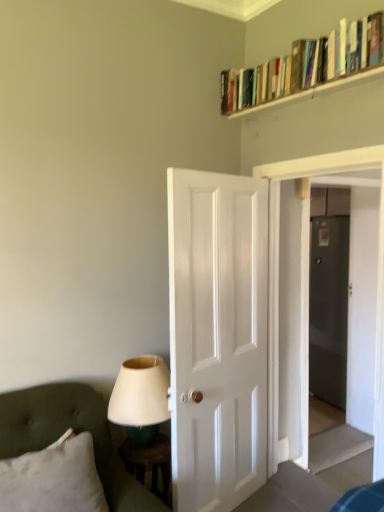
Question: Can you confirm if wooden stool at lower left is shorter than matte white lampshade at lower left?

Choices:
 (A) yes
 (B) no

Answer: (B)

Question: Can you confirm if wooden stool at lower left is thinner than matte white lampshade at lower left?

Choices:
 (A) yes
 (B) no

Answer: (A)

Question: Considering the relative sizes of wooden stool at lower left and matte white lampshade at lower left in the image provided, is wooden stool at lower left smaller than matte white lampshade at lower left?

Choices:
 (A) yes
 (B) no

Answer: (A)

Question: Does wooden stool at lower left have a greater width compared to matte white lampshade at lower left?

Choices:
 (A) no
 (B) yes

Answer: (A)

Question: Does wooden stool at lower left come in front of matte white lampshade at lower left?

Choices:
 (A) yes
 (B) no

Answer: (B)

Question: Considering the relative positions of white soft pillow at lower left and wooden stool at lower left in the image provided, is white soft pillow at lower left to the left or to the right of wooden stool at lower left?

Choices:
 (A) left
 (B) right

Answer: (A)

Question: Based on their sizes in the image, would you say white soft pillow at lower left is bigger or smaller than wooden stool at lower left?

Choices:
 (A) small
 (B) big

Answer: (B)

Question: From the image's perspective, is white soft pillow at lower left positioned above or below wooden stool at lower left?

Choices:
 (A) below
 (B) above

Answer: (B)

Question: Would you say white soft pillow at lower left is inside or outside wooden stool at lower left?

Choices:
 (A) inside
 (B) outside

Answer: (B)

Question: Would you say transparent glass door at center, which ranks as the 1th glass door in front-to-back order, is to the left or to the right of matte white lampshade at lower left in the picture?

Choices:
 (A) left
 (B) right

Answer: (B)

Question: Is transparent glass door at center, which ranks as the 1th glass door in front-to-back order, in front of or behind matte white lampshade at lower left in the image?

Choices:
 (A) behind
 (B) front

Answer: (A)

Question: Is point (375, 309) closer or farther from the camera than point (132, 439)?

Choices:
 (A) farther
 (B) closer

Answer: (A)

Question: From the image's perspective, relative to matte white lampshade at lower left, is transparent glass door at center, which is the 2th glass door in back-to-front order, above or below?

Choices:
 (A) below
 (B) above

Answer: (B)

Question: Is wooden bookshelf at upper right taller or shorter than matte white lampshade at lower left?

Choices:
 (A) short
 (B) tall

Answer: (A)

Question: Considering the relative positions of wooden bookshelf at upper right and matte white lampshade at lower left in the image provided, is wooden bookshelf at upper right to the left or to the right of matte white lampshade at lower left?

Choices:
 (A) left
 (B) right

Answer: (B)